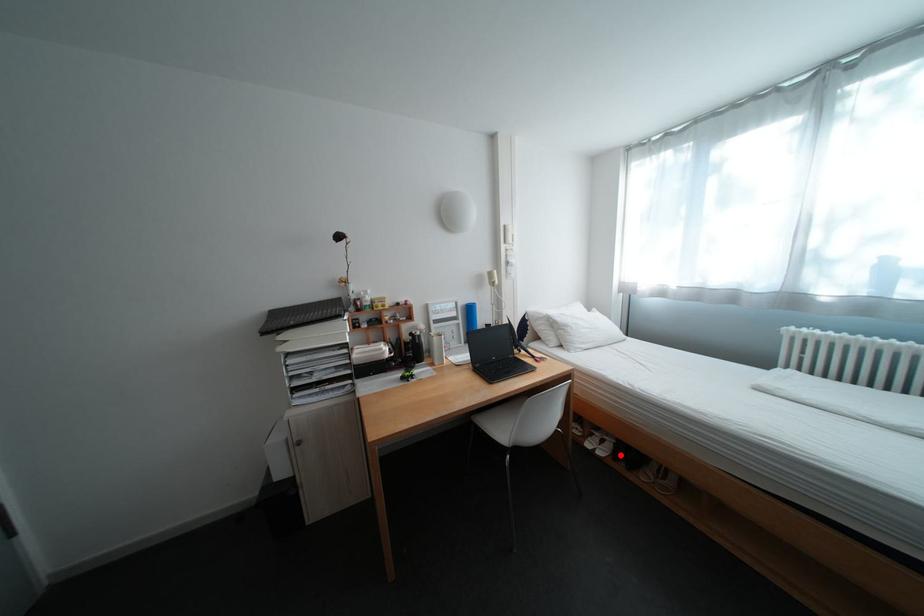
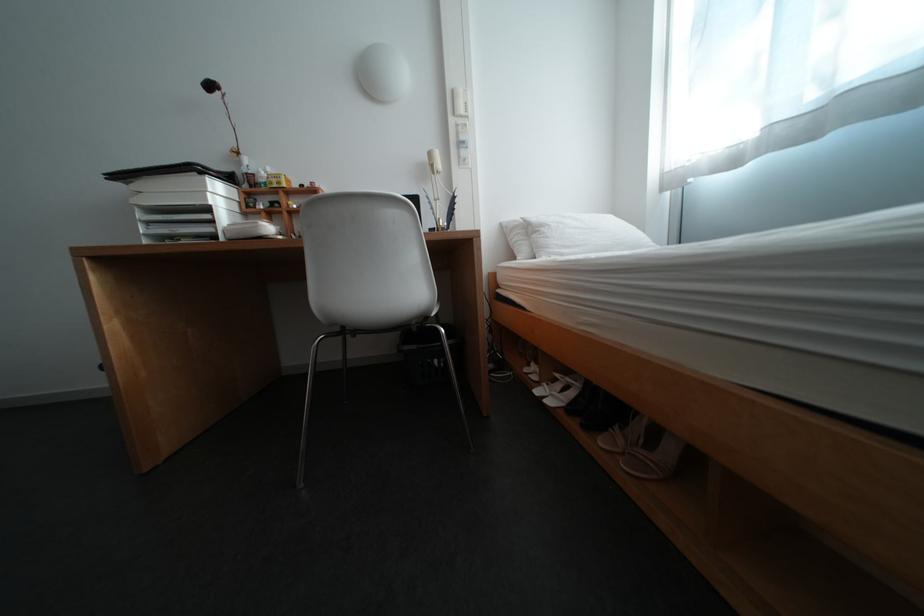
Question: I am providing you with two images of the same scene from different viewpoints. Given a red point in image1, look at the same physical point in image2. Is it:

Choices:
 (A) Closer to the viewpoint
 (B) Farther from the viewpoint

Answer: (A)